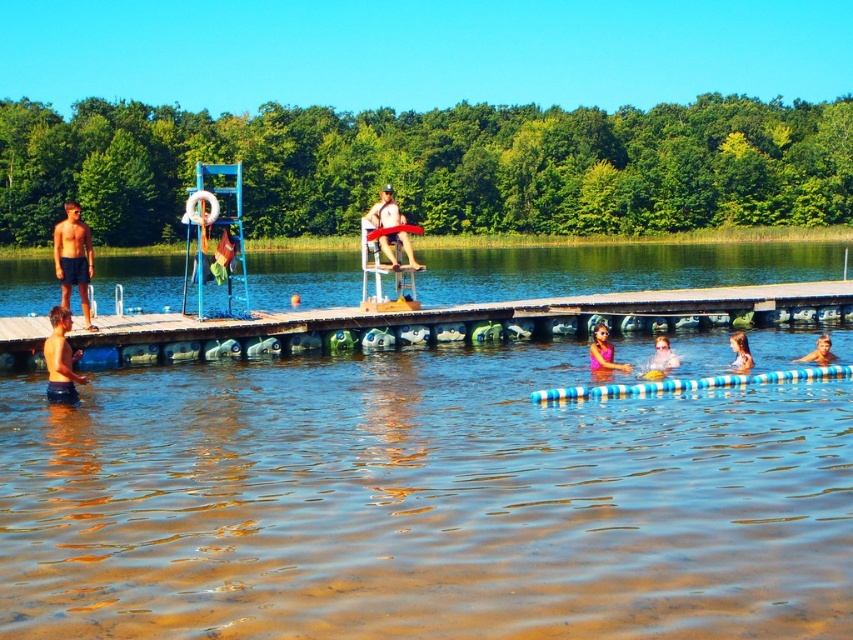
Between point (415, 353) and point (674, 355), which one is positioned in front?

Point (674, 355) is in front.

Can you confirm if clear plastic pool at center is wider than pink fabric at lower center?

Correct, the width of clear plastic pool at center exceeds that of pink fabric at lower center.

Which is in front, point (299, 428) or point (669, 349)?

Point (299, 428)

Where is `clear plastic pool at center`? clear plastic pool at center is located at coordinates (421, 502).

Is clear plastic pool at center above smooth blue swim ring at lower right?

No.

Who is positioned more to the left, clear plastic pool at center or smooth blue swim ring at lower right?

Positioned to the left is clear plastic pool at center.

Where is `clear plastic pool at center`? This screenshot has width=853, height=640. clear plastic pool at center is located at coordinates (421, 502).

You are a GUI agent. You are given a task and a screenshot of the screen. Output one action in this format:
    pyautogui.click(x=<x>, y=<y>)
    Task: Click on the blue wooden dock at center
    The height and width of the screenshot is (640, 853).
    Given the screenshot: What is the action you would take?
    pyautogui.click(x=457, y=323)

Who is lower down, blue wooden dock at center or matte blue shorts at left?

matte blue shorts at left is lower down.

Identify the location of blue wooden dock at center. The width and height of the screenshot is (853, 640). (457, 323).